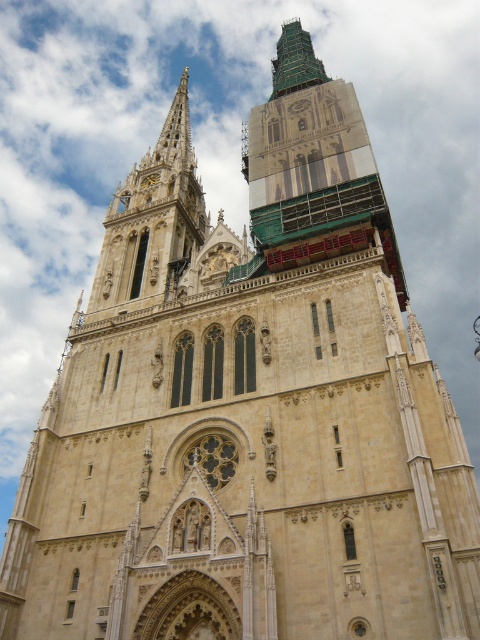
Looking at this image, what is the color of the object located at point (312, 164) in the image?

The object located at point (312, 164) is a green glass tower at upper center.

You are standing at the base of the green glass tower at upper center and want to take a photo of the camera. Given that the camera is 51.08 meters away, what is the minimum focal length lens you need to use to capture the entire camera in the frame if your camera sensor has a diagonal measurement of 24mm?

The minimum focal length required is calculated using the formula f_min < 0.707 x sensor diagonal x distance. Plugging in the values, f_min < 0.707 x 24mm x 51.08m. However, this calculation may not be accurate as the question does not specify the camera sensor size or the field of view required. Without additional information, it is impossible to determine the exact focal length needed.

You are an architect inspecting the cathedral construction site. You notice the green glass tower at upper center and the beige stone spire at upper left. Which one is positioned higher up in the image?

The green glass tower at upper center is located above the beige stone spire at upper left, so it is positioned higher up in the image.